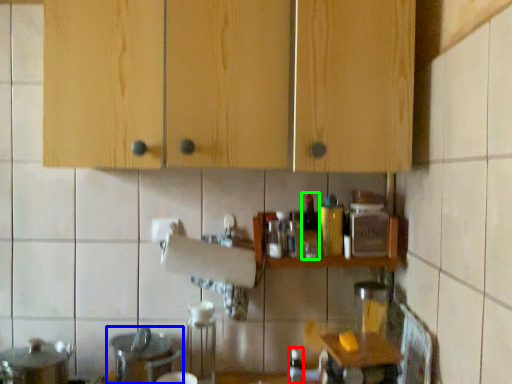
Question: Estimate the real-world distances between objects in this image. Which object is farther from bottle (highlighted by a red box), sink (highlighted by a blue box) or bottle (highlighted by a green box)?

Choices:
 (A) sink
 (B) bottle

Answer: (A)